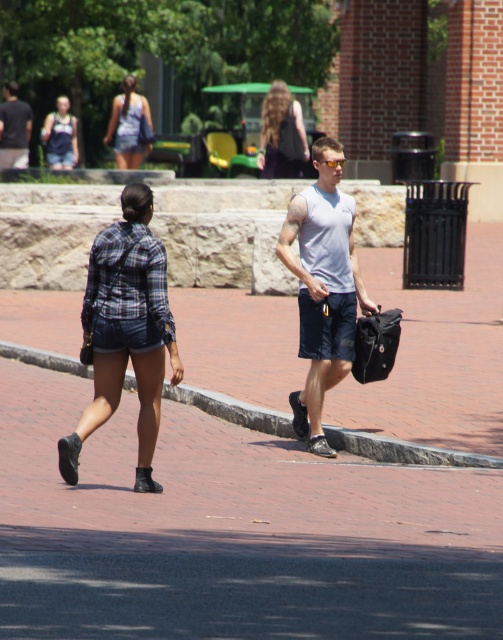
You are a photographer trying to capture a clear shot of the matte gray tank top at upper left and the matte blue shorts at upper left. Since you want both subjects in focus, you need to know their positions relative to each other. Which one is closer to the camera?

The matte gray tank top at upper left is in front of the matte blue shorts at upper left, so it is closer to the camera.

You are a delivery person who needs to place a package that is 15 inches wide on the brick at lower center or the matte black backpack at upper center. Which object can fit the package based on their widths?

The brick at lower center has a larger width than the matte black backpack at upper center, so the package can fit on the brick at lower center.

You are a photographer trying to capture a candid shot of the matte gray tank top at upper left and the matte blue shorts at upper left. Since you want to ensure both are in focus, you need to know their vertical positioning. Which one is positioned lower in the image?

The matte gray tank top at upper left is located below the matte blue shorts at upper left, so it is positioned lower in the image.